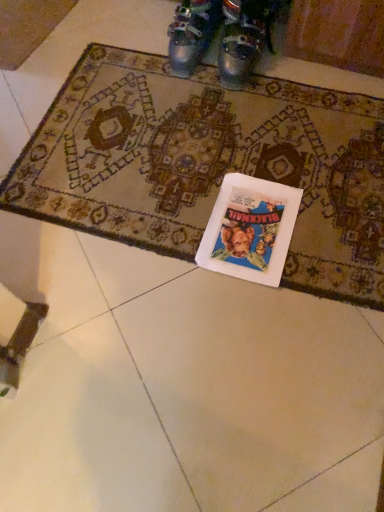
Find the location of `vacant area that lies to the right of metallic silver shoes at upper center, arranged as the 1th footwear when viewed from the right`. vacant area that lies to the right of metallic silver shoes at upper center, arranged as the 1th footwear when viewed from the right is located at coordinates (299, 68).